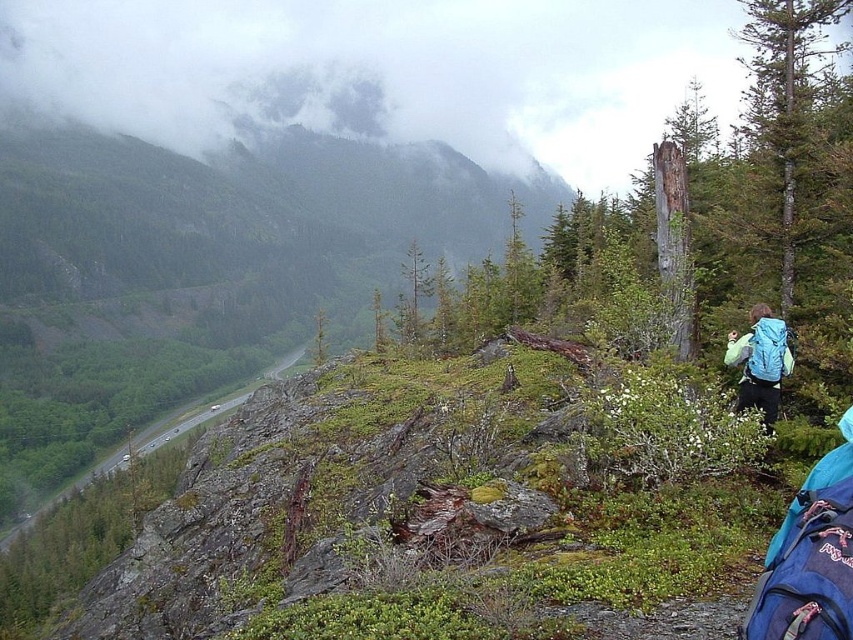
Question: Is blue backpack at right positioned at the back of green grassy trail at lower left?

Choices:
 (A) no
 (B) yes

Answer: (A)

Question: Among these points, which one is farthest from the camera?

Choices:
 (A) (305, 344)
 (B) (759, 310)

Answer: (A)

Question: Does blue backpack at right have a larger size compared to green grassy trail at lower left?

Choices:
 (A) no
 (B) yes

Answer: (A)

Question: Does blue backpack at right appear over green grassy trail at lower left?

Choices:
 (A) no
 (B) yes

Answer: (B)